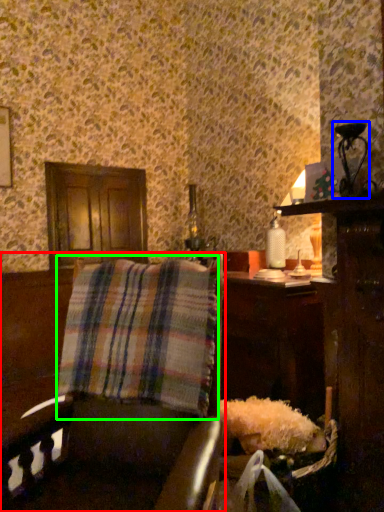
Question: Which is farther away from furniture (highlighted by a red box)? table lamp (highlighted by a blue box) or plaid (highlighted by a green box)?

Choices:
 (A) table lamp
 (B) plaid

Answer: (A)